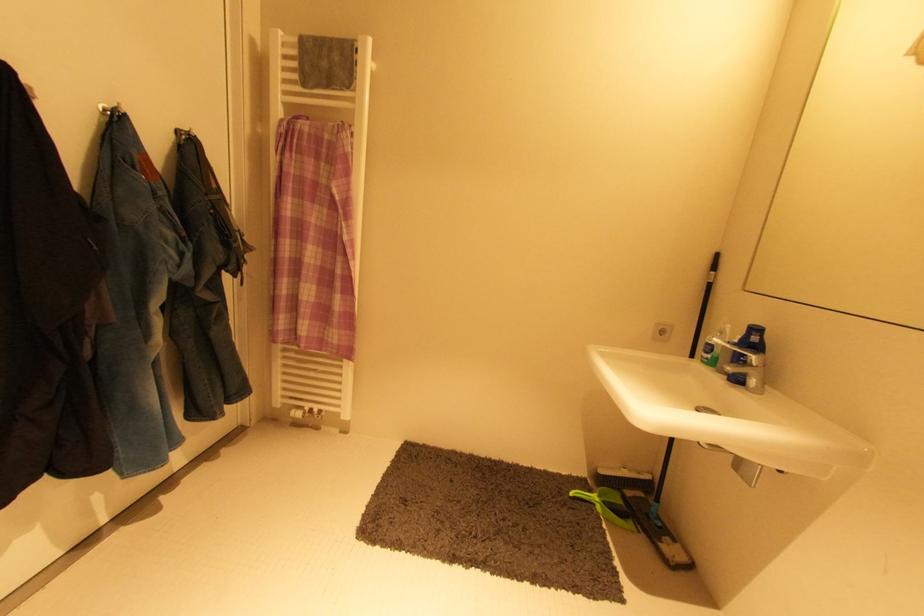
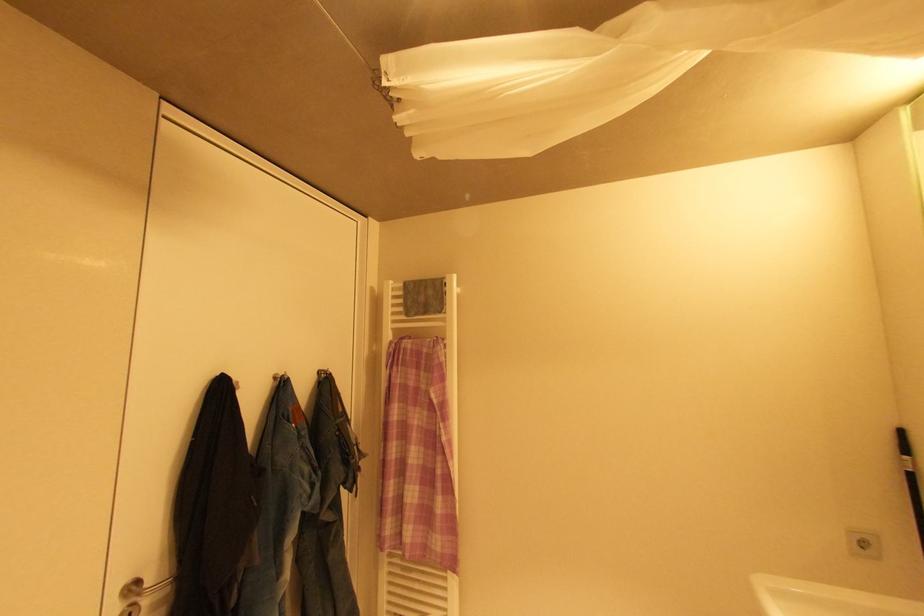
First-person continuous shooting, in which direction is the camera rotating?

The camera rotated toward left-up.